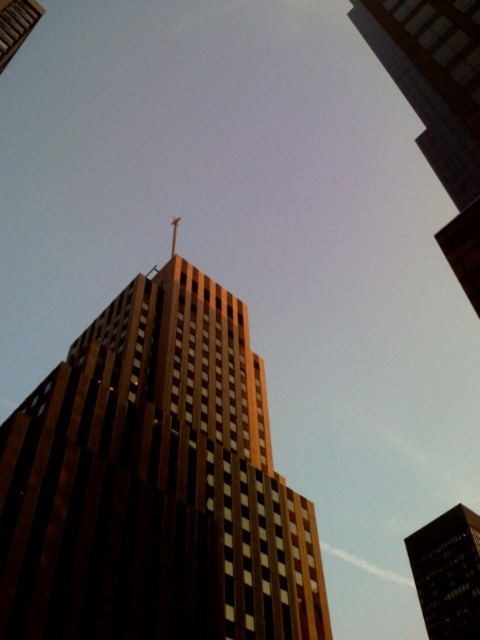
In the scene shown: You are standing at the center of the image and want to locate the brown textured building at center. What are the coordinates where you should look?

The brown textured building at center is located at coordinates point [155,483].

You are an architect analyzing the building design. The brown textured building at center and the shiny gold spire at top are part of the same structure. Which one is shorter?

The brown textured building at center is shorter than the shiny gold spire at top.